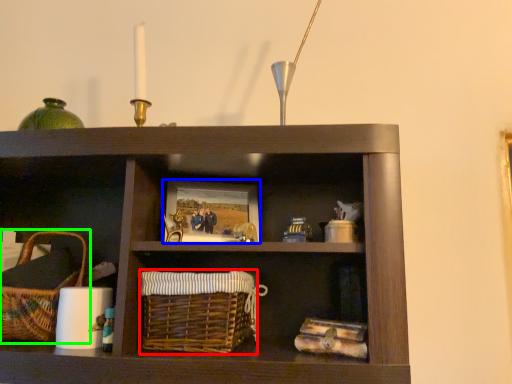
Question: Which object is the farthest from basket (highlighted by a red box)? Choose among these: picture frame (highlighted by a blue box) or picnic basket (highlighted by a green box).

Choices:
 (A) picture frame
 (B) picnic basket

Answer: (B)